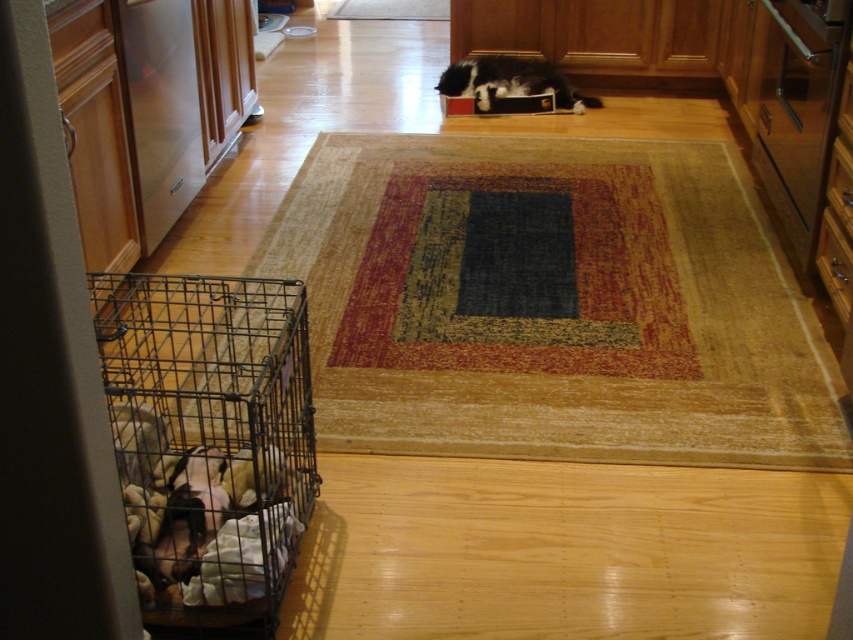
Is metal wire cage at lower left thinner than black and white fur cat at center?

Yes, metal wire cage at lower left is thinner than black and white fur cat at center.

Between point (213, 497) and point (491, 90), which one is positioned in front?

Point (213, 497) is more forward.

Find the location of `metal wire cage at lower left`. metal wire cage at lower left is located at coordinates (207, 442).